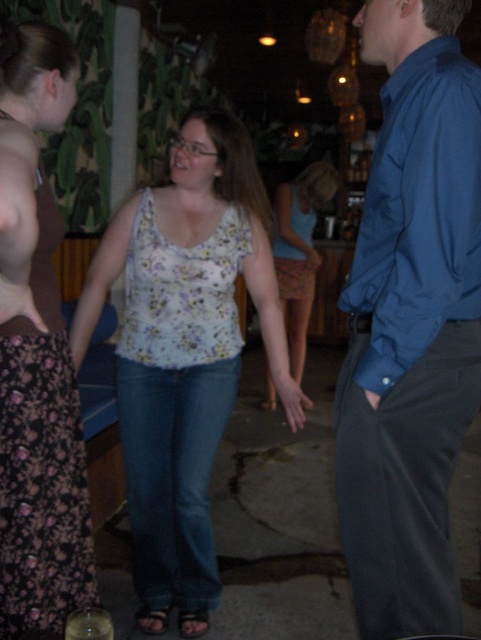
Can you confirm if blue smooth shirt at right is thinner than floral fabric blouse at center?

Yes.

This screenshot has width=481, height=640. What do you see at coordinates (410, 323) in the screenshot? I see `blue smooth shirt at right` at bounding box center [410, 323].

Where is `blue smooth shirt at right`? blue smooth shirt at right is located at coordinates (410, 323).

Consider the image. Can you confirm if floral fabric blouse at center is bigger than floral fabric dress at left?

Yes, floral fabric blouse at center is bigger than floral fabric dress at left.

Locate an element on the screen. floral fabric blouse at center is located at coordinates (185, 360).

The height and width of the screenshot is (640, 481). What do you see at coordinates (185, 360) in the screenshot?
I see `floral fabric blouse at center` at bounding box center [185, 360].

This screenshot has width=481, height=640. In order to click on floral fabric blouse at center in this screenshot , I will do `click(185, 360)`.

Does blue smooth shirt at right have a lesser height compared to floral fabric top at center?

Indeed, blue smooth shirt at right has a lesser height compared to floral fabric top at center.

Is blue smooth shirt at right wider than floral fabric top at center?

No.

The height and width of the screenshot is (640, 481). Identify the location of blue smooth shirt at right. (410, 323).